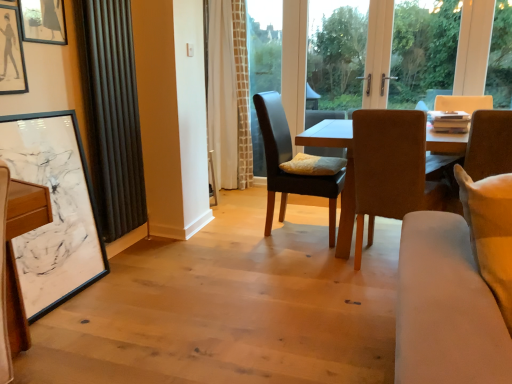
Locate an element on the screen. This screenshot has height=384, width=512. free spot below black ribbed curtain at left, which appears as the 1th curtain when viewed from the left (from a real-world perspective) is located at coordinates (128, 244).